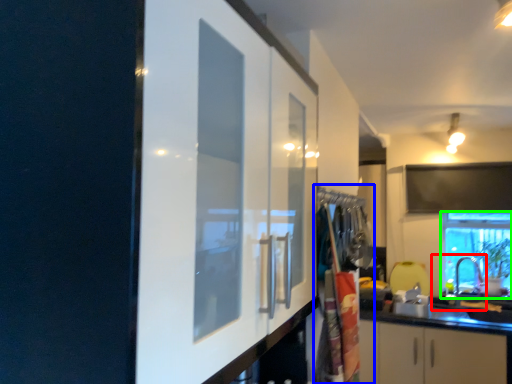
Question: Estimate the real-world distances between objects in this image. Which object is farther from sink (highlighted by a red box), laundry (highlighted by a blue box) or window (highlighted by a green box)?

Choices:
 (A) laundry
 (B) window

Answer: (A)